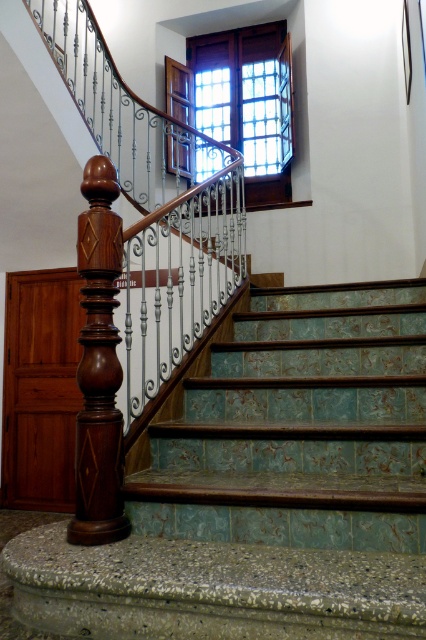
You are a delivery person holding a package that requires a 1.80 meter clearance to pass through narrow spaces. You need to navigate down the green textured tile stairs at center. Can you safely descend the stairs without hitting your head?

The distance between the green textured tile stairs at center and the camera is 1.70 meters. Since the required clearance is 1.80 meters, which is greater than the available space, you cannot safely descend the stairs without risking head contact.

You are a delivery person carrying a heavy box and need to climb the staircase. Considering the green textured tile stairs at center and the polished wood post at center, which one is lower in height and thus easier to step over?

The green textured tile stairs at center has a lesser height compared to the polished wood post at center, so it is lower and easier to step over.

You are standing at the bottom of the staircase and want to reach a decorative item placed at point (x=103, y=541). If your reach extends 6 feet forward, can you grab it without moving closer?

The distance of point (x=103, y=541) from the viewer is 5.99 feet, so yes, you can grab the decorative item at point (x=103, y=541) with your reach of 6 feet since it is just within range.